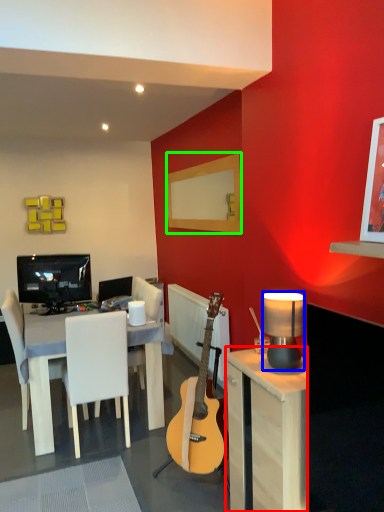
Question: Estimate the real-world distances between objects in this image. Which object is closer to desk (highlighted by a red box), lamp (highlighted by a blue box) or mirror (highlighted by a green box)?

Choices:
 (A) lamp
 (B) mirror

Answer: (A)